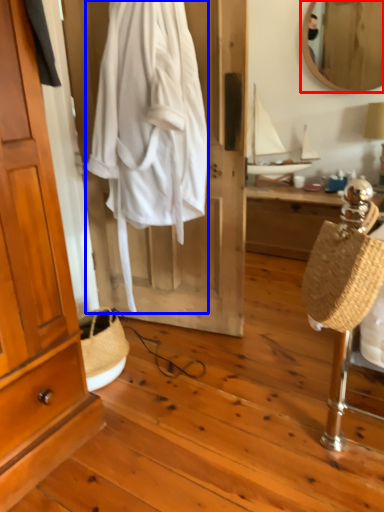
Question: Which object is closer to the camera taking this photo, mirror (highlighted by a red box) or clothing (highlighted by a blue box)?

Choices:
 (A) mirror
 (B) clothing

Answer: (B)